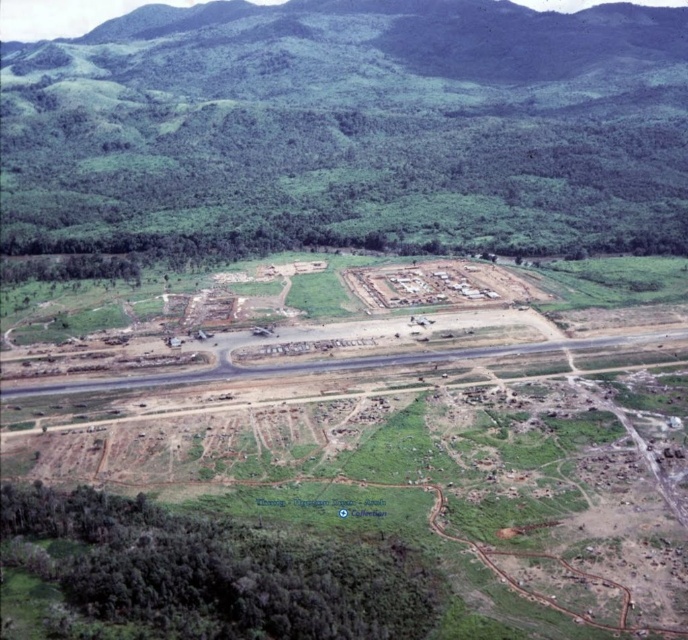
Based on the aerial view of the construction site, what does the point at coordinates (350,129) correspond to?

The point at coordinates (350,129) corresponds to the green leafy forest at upper center.

You are a drone operator tasked with capturing aerial images of a construction site. Your drone is currently hovering at point coordinates of 0.3, 0.5. You need to take a photo of the green leafy forest at upper center. Which direction should you move the drone to get closer to the forest?

The green leafy forest at upper center is located at point (350, 129). Since your current position is at (344, 192), you should move the drone slightly to the left to decrease the x coordinate from 0.3 to 0.203 while maintaining the y coordinate around 0.509 to align with the forest.